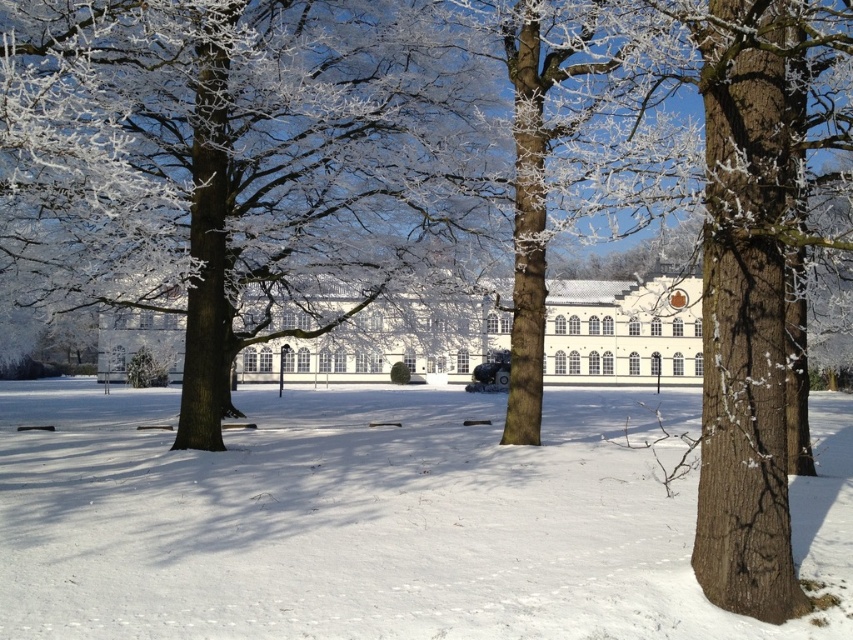
Question: Which object is the closest to the white smooth building at center?

Choices:
 (A) white powdery snow at center
 (B) smooth brown tree trunk at center

Answer: (B)

Question: Which point is farther to the camera?

Choices:
 (A) smooth brown tree trunk at center
 (B) white smooth building at center

Answer: (B)

Question: Does smooth brown tree trunk at center have a lesser width compared to white smooth building at center?

Choices:
 (A) yes
 (B) no

Answer: (A)

Question: From the image, what is the correct spatial relationship of white powdery snow at center in relation to white smooth building at center?

Choices:
 (A) left
 (B) right

Answer: (B)

Question: Among these objects, which one is nearest to the camera?

Choices:
 (A) white smooth building at center
 (B) white powdery snow at center
 (C) smooth brown tree trunk at center

Answer: (B)

Question: Does white powdery snow at center appear on the right side of white smooth building at center?

Choices:
 (A) no
 (B) yes

Answer: (B)